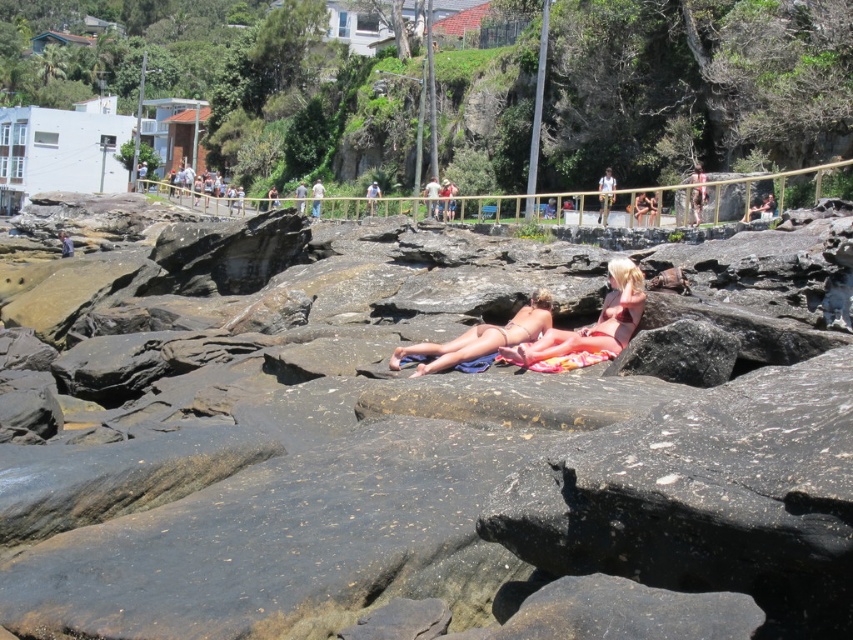
Question: Which point is farther to the camera?

Choices:
 (A) matte brown couple at center
 (B) pink fabric bikini at center

Answer: (A)

Question: Which point is farther from the camera taking this photo?

Choices:
 (A) (218, 188)
 (B) (322, 193)

Answer: (A)

Question: Is light brown leather jacket at upper center positioned in front of light brown wooden post at center?

Choices:
 (A) no
 (B) yes

Answer: (B)

Question: Which point appears farthest from the camera in this image?

Choices:
 (A) (428, 365)
 (B) (178, 186)

Answer: (B)

Question: Can you confirm if matte brown couple at center is positioned below light brown wooden post at center?

Choices:
 (A) no
 (B) yes

Answer: (B)

Question: From the image, what is the correct spatial relationship of pink fabric bikini at center in relation to matte brown couple at center?

Choices:
 (A) above
 (B) below

Answer: (B)